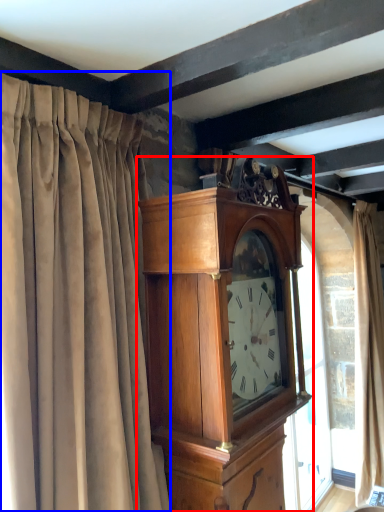
Question: Which object appears farthest to the camera in this image, wall clock (highlighted by a red box) or curtain (highlighted by a blue box)?

Choices:
 (A) wall clock
 (B) curtain

Answer: (A)